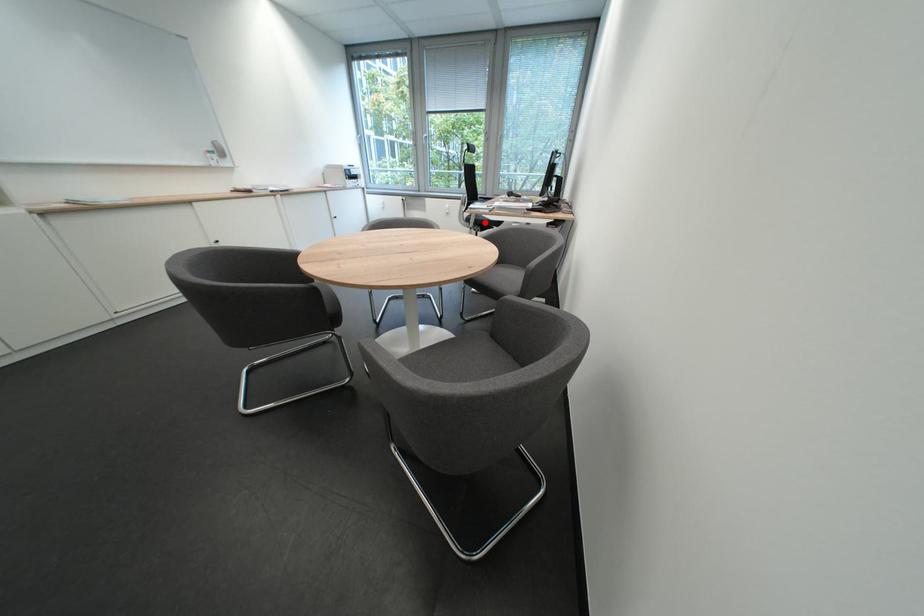
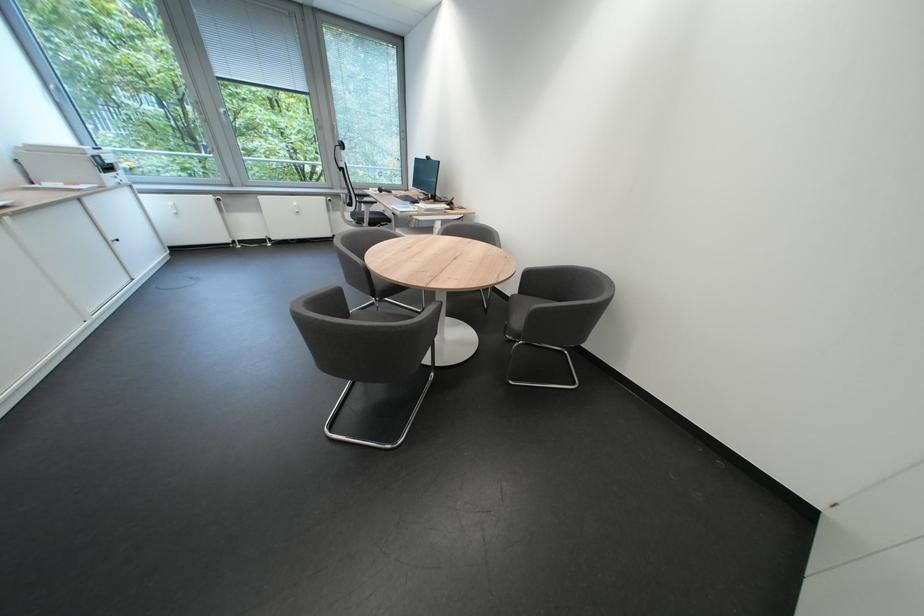
Question: I am providing you with two images of the same scene from different viewpoints. In image1, a red point is highlighted. Considering the same 3D point in image2, which of the following is correct?

Choices:
 (A) It is closer
 (B) It is farther

Answer: (A)